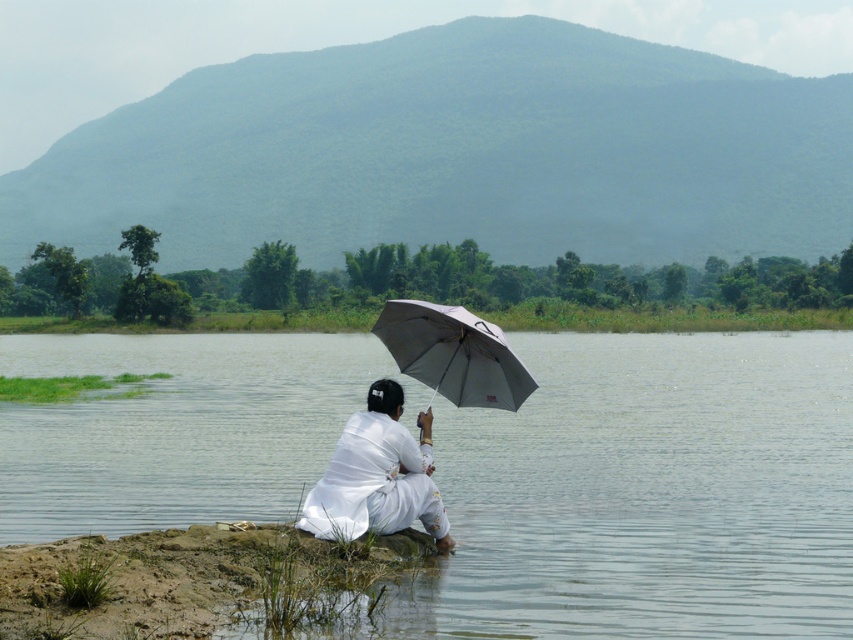
Question: Can you confirm if white matte fabric at center is positioned above gray matte umbrella at center?

Choices:
 (A) yes
 (B) no

Answer: (B)

Question: Which object is positioned closest to the clear water at lower center?

Choices:
 (A) gray matte umbrella at center
 (B) white matte fabric at center

Answer: (B)

Question: Among these objects, which one is farthest from the camera?

Choices:
 (A) gray matte umbrella at center
 (B) white matte fabric at center

Answer: (A)

Question: Does clear water at lower center appear on the right side of gray matte umbrella at center?

Choices:
 (A) no
 (B) yes

Answer: (B)

Question: Considering the real-world distances, which object is farthest from the clear water at lower center?

Choices:
 (A) gray matte umbrella at center
 (B) white matte fabric at center

Answer: (A)

Question: Is clear water at lower center to the left of gray matte umbrella at center from the viewer's perspective?

Choices:
 (A) no
 (B) yes

Answer: (A)